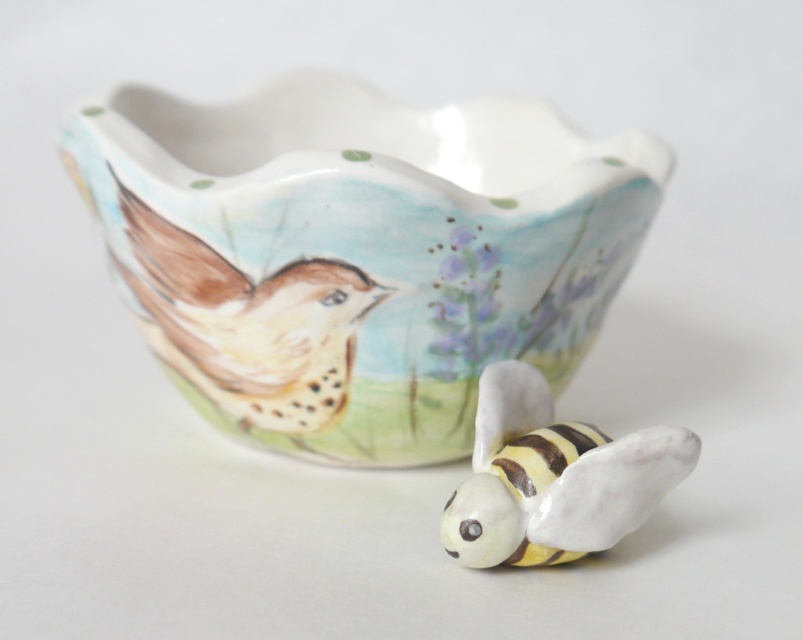
Question: Which object is positioned closest to the white glossy bee at lower right?

Choices:
 (A) hand-painted ceramic bird at center
 (B) porcelain bowl at center

Answer: (B)

Question: Which point is closer to the camera taking this photo?

Choices:
 (A) (263, 342)
 (B) (626, 532)

Answer: (B)

Question: Is porcelain bowl at center further to the viewer compared to hand-painted ceramic bird at center?

Choices:
 (A) no
 (B) yes

Answer: (A)

Question: Which point is closer to the camera?

Choices:
 (A) white glossy bee at lower right
 (B) porcelain bowl at center
 (C) hand-painted ceramic bird at center

Answer: (A)

Question: Is porcelain bowl at center below hand-painted ceramic bird at center?

Choices:
 (A) yes
 (B) no

Answer: (B)

Question: Is hand-painted ceramic bird at center to the right of white glossy bee at lower right from the viewer's perspective?

Choices:
 (A) no
 (B) yes

Answer: (A)